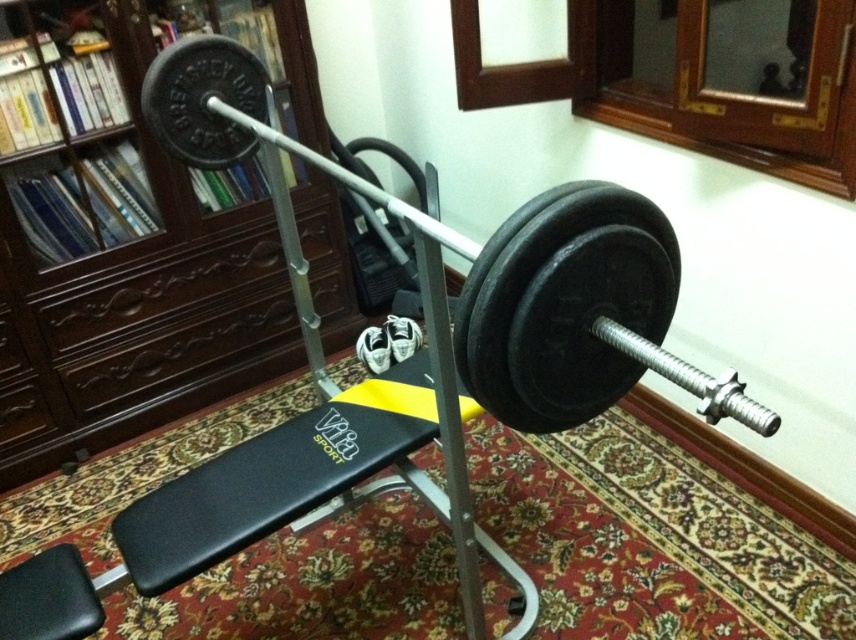
Question: Does dark wood bookshelf at upper left appear on the right side of black rubber barbell at center?

Choices:
 (A) yes
 (B) no

Answer: (B)

Question: Among these points, which one is farthest from the camera?

Choices:
 (A) (504, 234)
 (B) (49, 250)

Answer: (B)

Question: Is dark wood bookshelf at upper left positioned behind black rubber barbell at center?

Choices:
 (A) yes
 (B) no

Answer: (A)

Question: Among these objects, which one is farthest from the camera?

Choices:
 (A) black rubber barbell at center
 (B) dark wood bookshelf at upper left

Answer: (B)

Question: Which point is farther to the camera?

Choices:
 (A) (1, 92)
 (B) (524, 250)

Answer: (A)

Question: Can you confirm if dark wood bookshelf at upper left is positioned below black rubber barbell at center?

Choices:
 (A) no
 (B) yes

Answer: (A)